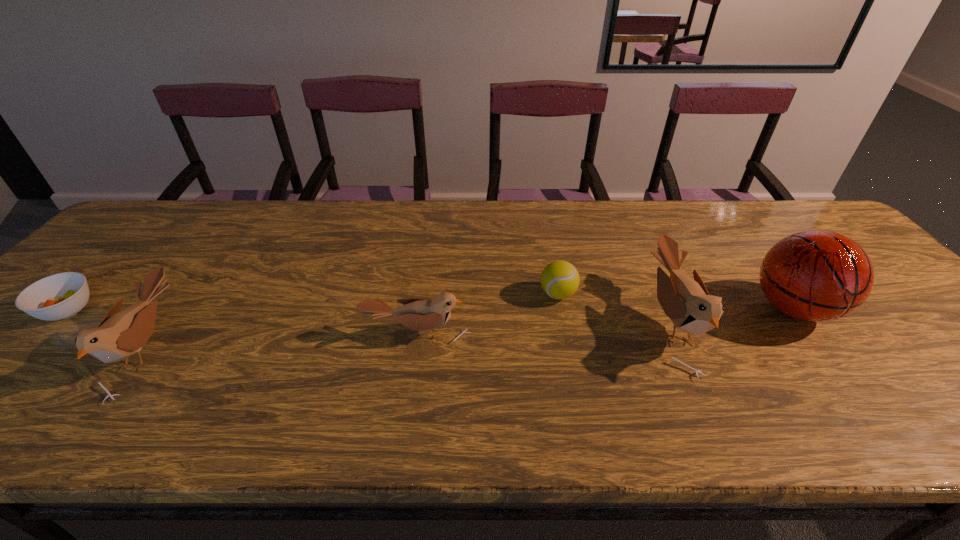
At what (x,y) coordinates should I click in order to perform the action: click on the second object from left to right. Please return your answer as a coordinate pair (x, y). Looking at the image, I should click on (122, 333).

The width and height of the screenshot is (960, 540). I want to click on the second tallest bird, so click(x=122, y=333).

Locate an element on the screen. The height and width of the screenshot is (540, 960). the shortest bird is located at coordinates (416, 314).

Find the location of `the third shortest object`. the third shortest object is located at coordinates (416, 314).

This screenshot has height=540, width=960. What are the coordinates of `the rightmost bird` in the screenshot? It's located at (685, 301).

Identify the location of basketball. (816, 276).

The height and width of the screenshot is (540, 960). In order to click on the tallest object in this screenshot , I will do `click(816, 276)`.

Identify the location of the second shortest object. The height and width of the screenshot is (540, 960). (559, 279).

Find the location of a particular element. Image resolution: width=960 pixels, height=540 pixels. tennis ball is located at coordinates (559, 279).

Where is `soup bowl`? This screenshot has width=960, height=540. soup bowl is located at coordinates (59, 296).